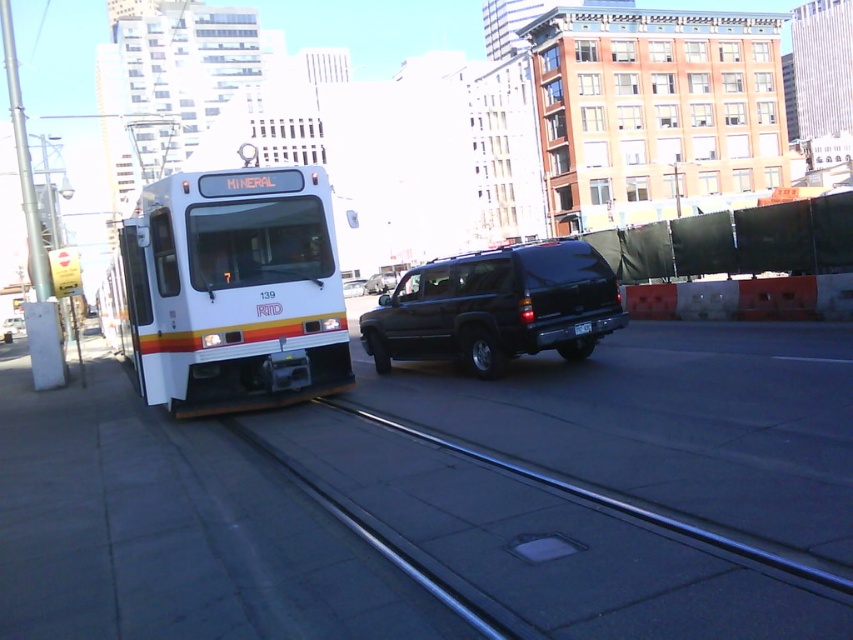
Question: Does metallic rail at center have a smaller size compared to shiny black suv at center?

Choices:
 (A) yes
 (B) no

Answer: (A)

Question: Can you confirm if metallic rail at center is smaller than shiny black suv at center?

Choices:
 (A) yes
 (B) no

Answer: (A)

Question: Which object is positioned farthest from the satin black suv at center?

Choices:
 (A) shiny black suv at center
 (B) metallic rail at center
 (C) black plastic license plate at center

Answer: (B)

Question: Which object is closer to the camera taking this photo?

Choices:
 (A) satin black suv at center
 (B) shiny black suv at center
 (C) metallic rail at center

Answer: (C)

Question: Does metallic rail at center appear on the right side of shiny black suv at center?

Choices:
 (A) no
 (B) yes

Answer: (B)

Question: Among these objects, which one is nearest to the camera?

Choices:
 (A) satin black suv at center
 (B) metallic rail at center

Answer: (B)